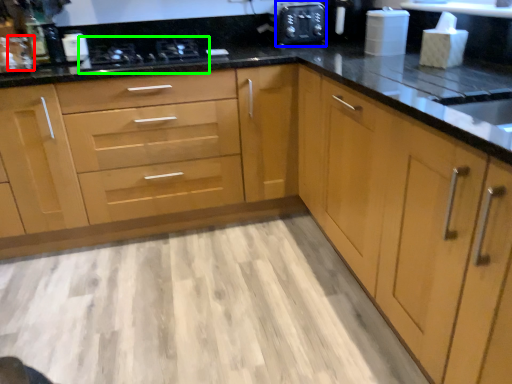
Question: Which is nearer to the faucet (highlighted by a red box)? appliance (highlighted by a blue box) or stove (highlighted by a green box).

Choices:
 (A) appliance
 (B) stove

Answer: (B)